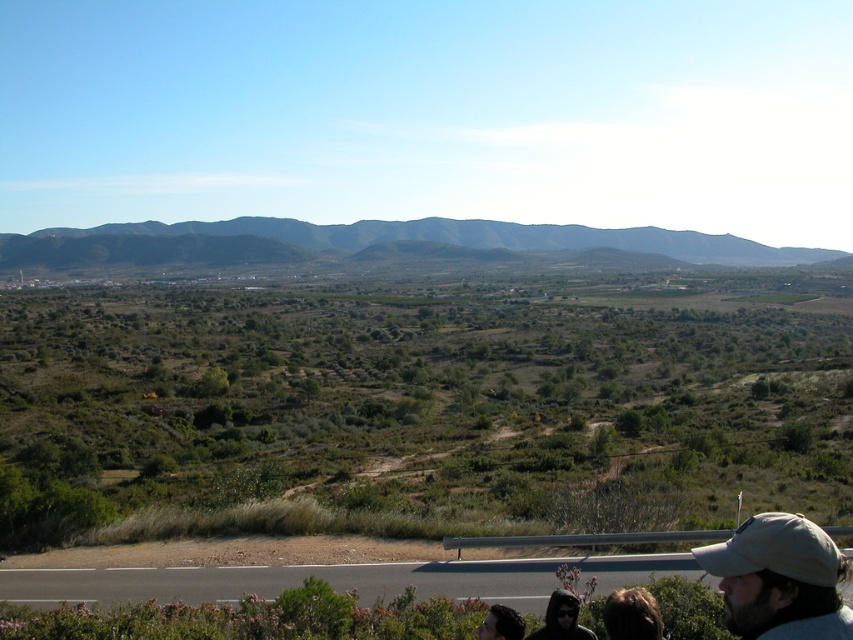
You are standing at the viewpoint looking at the dark green textured mountains at upper center and the beige fabric cap at lower right. Which object is positioned higher in the image?

The dark green textured mountains at upper center are positioned higher in the image than the beige fabric cap at lower right.

You are a hiker standing at the asphalt road at lower center and want to reach the dark green textured mountains at upper center. If your average walking speed is 3 miles per hour, how many minutes will it take you to reach the mountains?

The asphalt road at lower center is 1358.25 feet from the dark green textured mountains at upper center. Converting feet to miles, 1358.25 feet is approximately 0.257 miles. At a walking speed of 3 miles per hour, it would take roughly 5.14 minutes. So, it will take about 5 minutes to reach the dark green textured mountains at upper center.

You are standing at the viewpoint on the paved road and want to walk to the point marked as point (410, 234). However, there is an obstacle at point (782, 566) blocking your path. Can you reach your destination without going around the obstacle?

Since point (410, 234) is behind point (782, 566), you cannot reach point (410, 234) without going around the obstacle at point (782, 566).